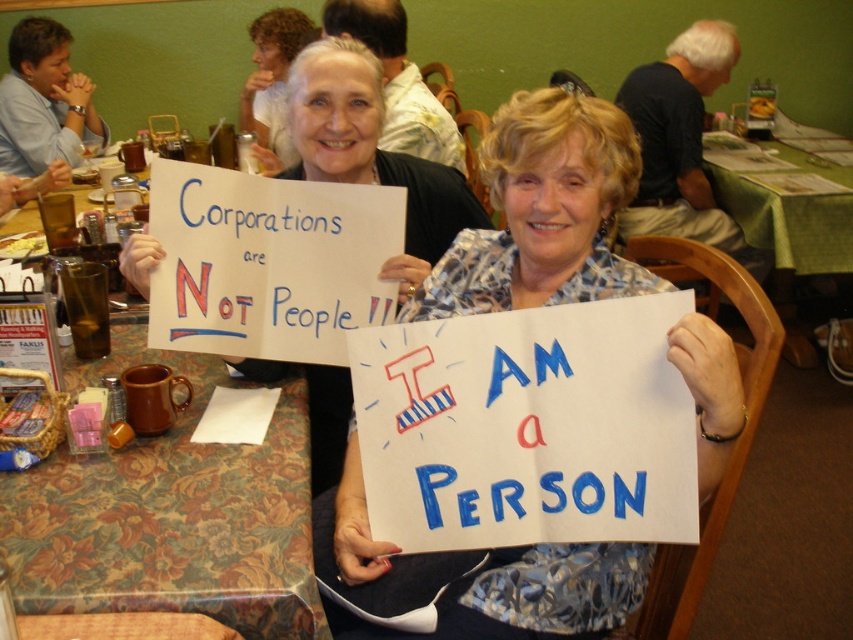
Question: Which point appears farthest from the camera in this image?

Choices:
 (A) (358, 92)
 (B) (36, 134)

Answer: (B)

Question: Is white paper sign at center bigger than floral-patterned tablecloth at lower left?

Choices:
 (A) no
 (B) yes

Answer: (B)

Question: Which of these objects is positioned closest to the white paper sign at center?

Choices:
 (A) green fabric table at center
 (B) floral-patterned tablecloth at lower left
 (C) brushed metal fork at upper left
 (D) white paper at upper center

Answer: (B)

Question: Which point is closer to the camera?

Choices:
 (A) floral-patterned tablecloth at lower left
 (B) green fabric table at center
 (C) white paper at upper center
 (D) white paper sign at center

Answer: (A)

Question: Is floral-patterned tablecloth at lower left bigger than green fabric table at center?

Choices:
 (A) yes
 (B) no

Answer: (B)

Question: Can you confirm if white paper at upper center is positioned below green fabric table at center?

Choices:
 (A) yes
 (B) no

Answer: (A)